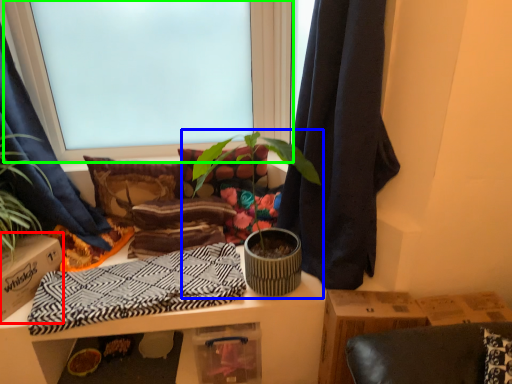
Question: Which is nearer to the cardboard box (highlighted by a red box)? houseplant (highlighted by a blue box) or window (highlighted by a green box).

Choices:
 (A) houseplant
 (B) window

Answer: (A)